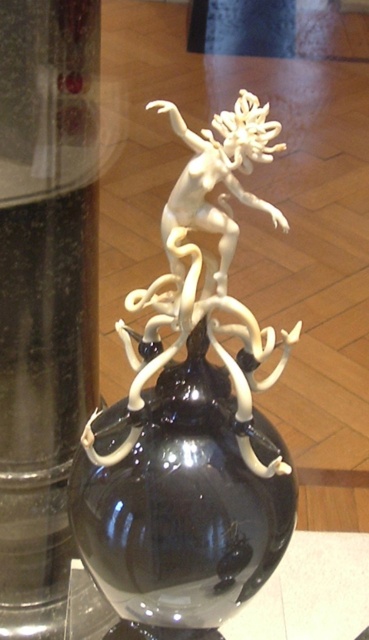
You are an art curator standing at the entrance of the gallery. You want to place a new sculpture exactly 1 meter to the right of the black glass vase at center. Where should you place it?

Since the black glass vase at center is located at point 2D coordinates of (184, 508), you should place the new sculpture 1 meter to the right of those coordinates.

You are an art conservator who needs to clean the black glass vase at center. Your cleaning tool has a maximum reach of 30 inches. Can you safely clean the vase without moving any nearby objects?

The black glass vase at center is 28.14 inches away from the viewer, which is within the 30 inch reach of the cleaning tool. Yes, you can safely clean the vase without moving any nearby objects.

You are an art conservator examining the sculpture. You notice two points on the sculpture marked at coordinates point (x=146, y=451) and point (x=260, y=604). Which point is nearer to your viewpoint?

Point (x=146, y=451) is closer to the viewer than point (x=260, y=604).